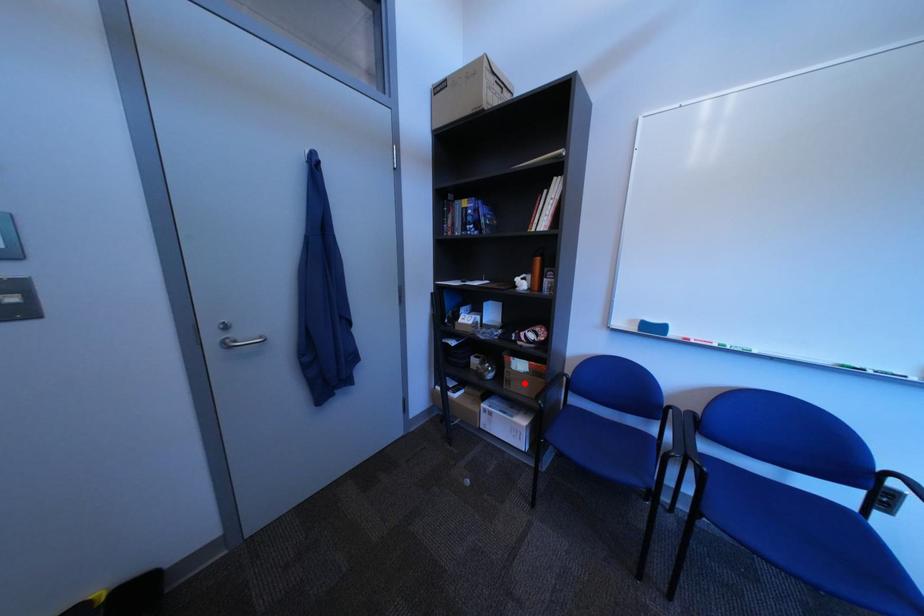
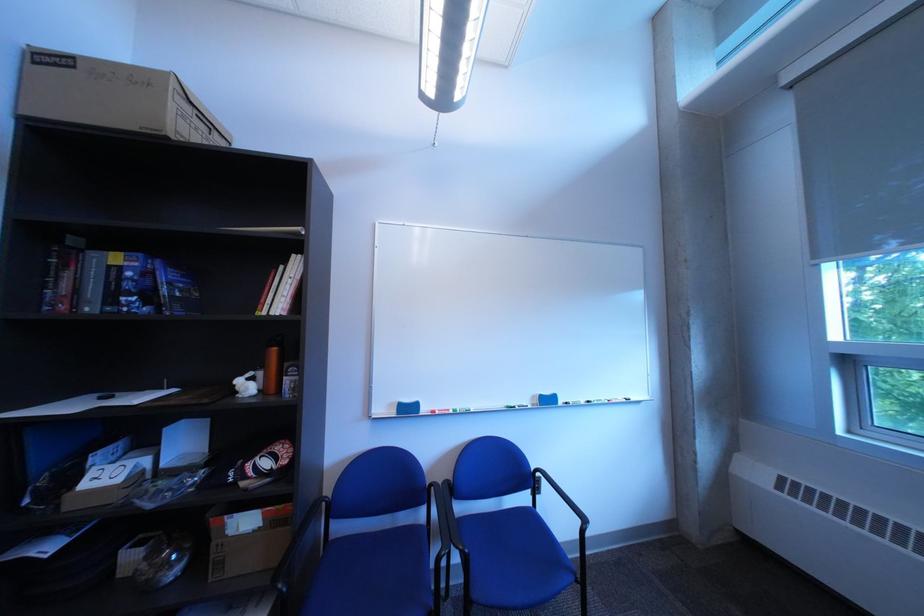
Question: I am providing you with two images of the same scene from different viewpoints. A red point is marked on the first image. Is the red point's position out of view in image 2?

Choices:
 (A) Yes
 (B) No

Answer: (B)